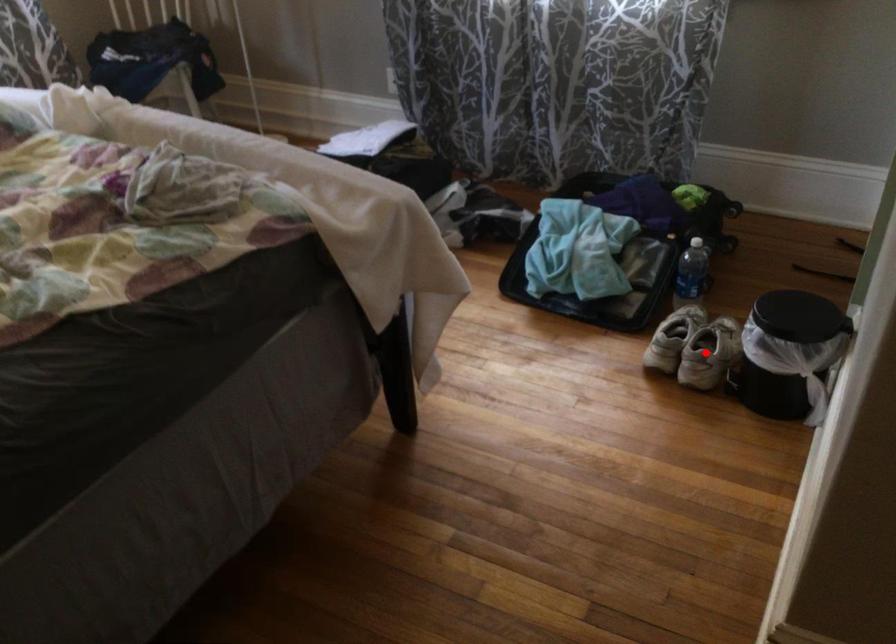
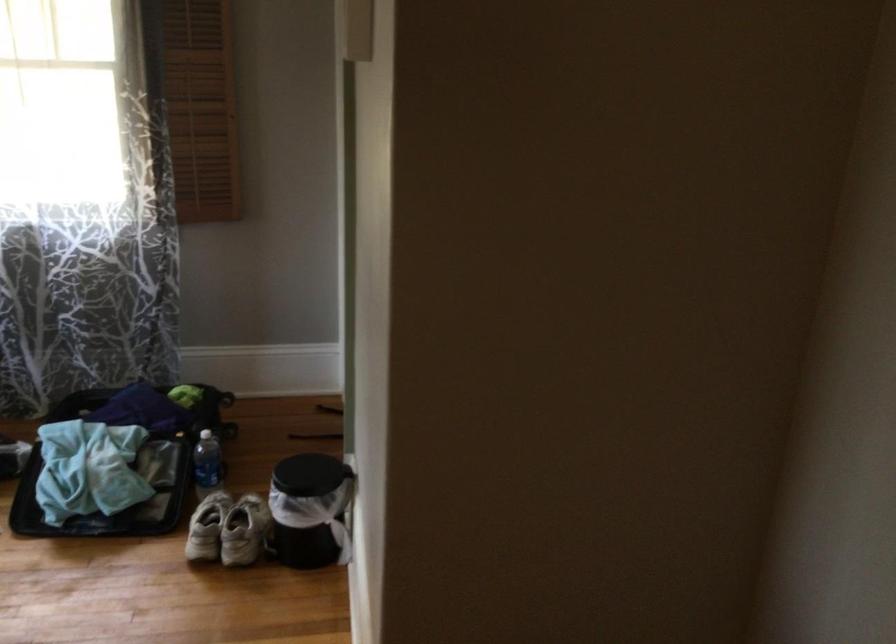
In the second image, find the point that corresponds to the highlighted location in the first image.

(244, 531)